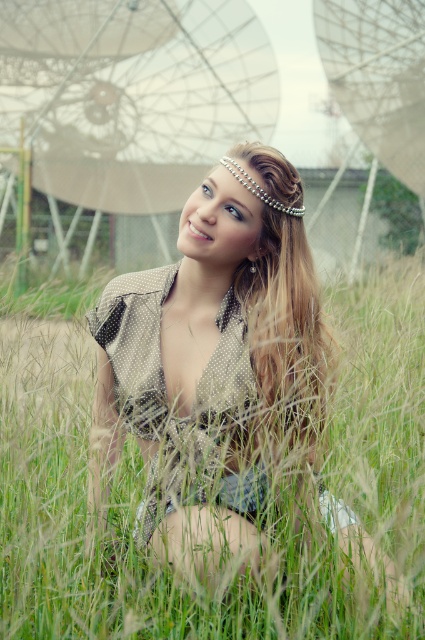
You are a photographer trying to capture the person in the scene. Since the matte beige dress at center and the blonde textured hair at center are both at the center, how can you ensure the dress is visible in the photo?

The matte beige dress at center is positioned under the blonde textured hair at center, so adjusting the angle to look downward slightly would allow the dress to be seen beneath the hair.